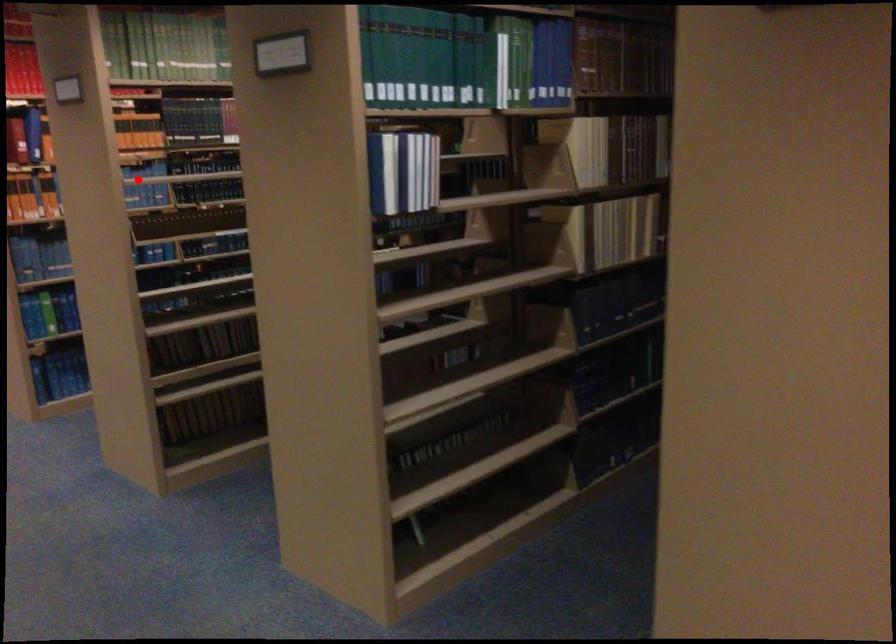
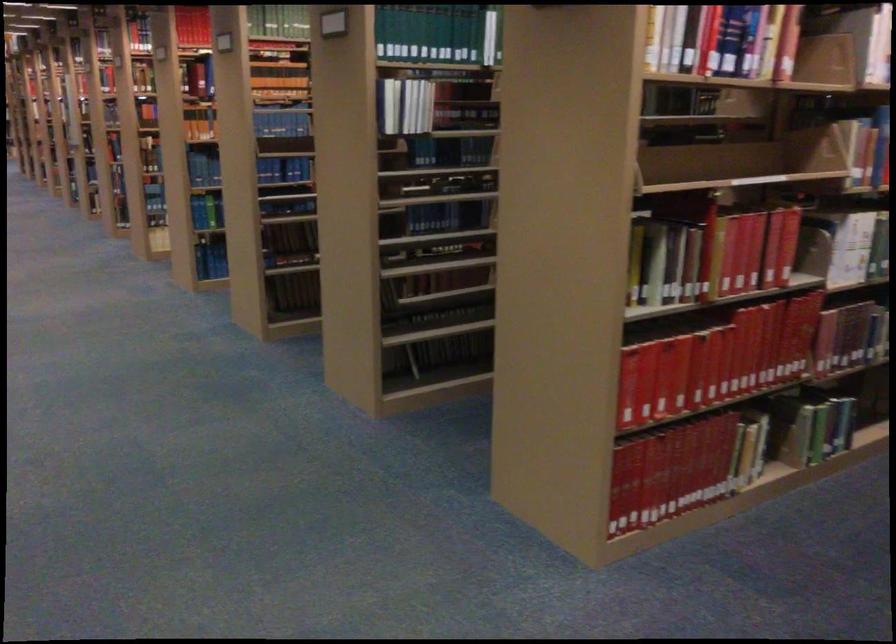
Find the pixel in the second image that matches the highlighted location in the first image.

(280, 122)